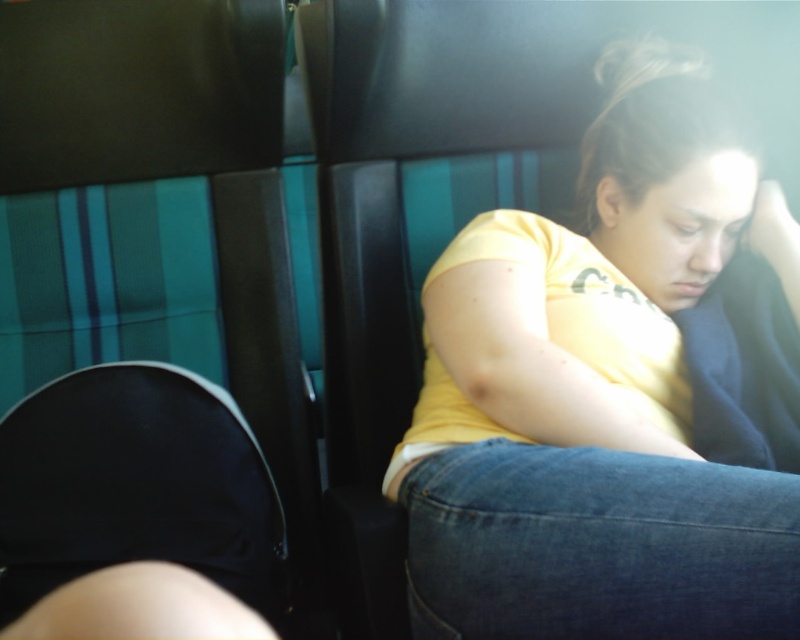
Question: Can you confirm if yellow cotton shirt at center is smaller than black leather chair at upper left?

Choices:
 (A) no
 (B) yes

Answer: (A)

Question: In this image, where is yellow cotton shirt at center located relative to black leather chair at upper left?

Choices:
 (A) right
 (B) left

Answer: (A)

Question: Which object appears closest to the camera in this image?

Choices:
 (A) black leather chair at upper left
 (B) yellow cotton shirt at center

Answer: (B)

Question: Does yellow cotton shirt at center come behind black leather chair at upper left?

Choices:
 (A) yes
 (B) no

Answer: (B)